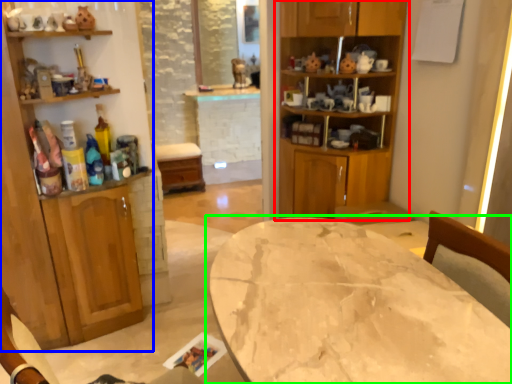
Question: Which is farther away from cabinetry (highlighted by a red box)? cabinetry (highlighted by a blue box) or table (highlighted by a green box)?

Choices:
 (A) cabinetry
 (B) table

Answer: (B)